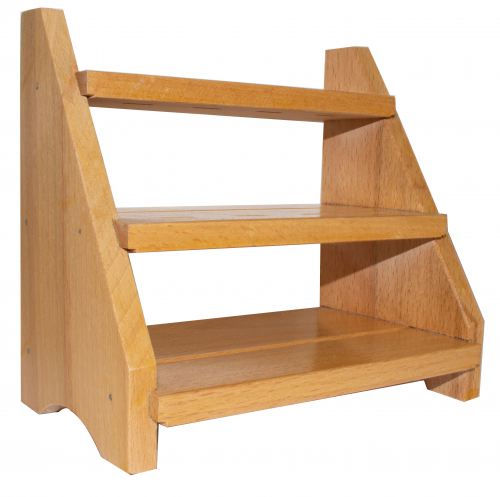
Locate an element on the screen. This screenshot has height=497, width=500. stair case is located at coordinates (175, 394).